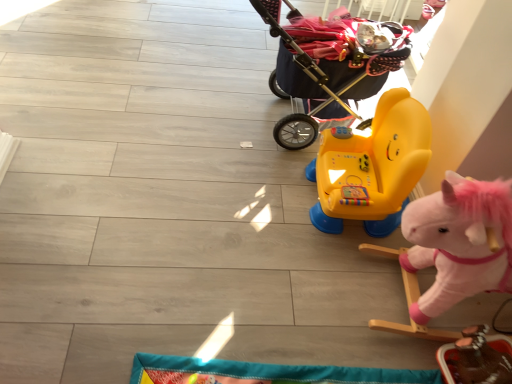
Identify the location of vacant space in fluffy pink rocking horse at right, the second toy when ordered from top to bottom (from a real-world perspective). (423, 291).